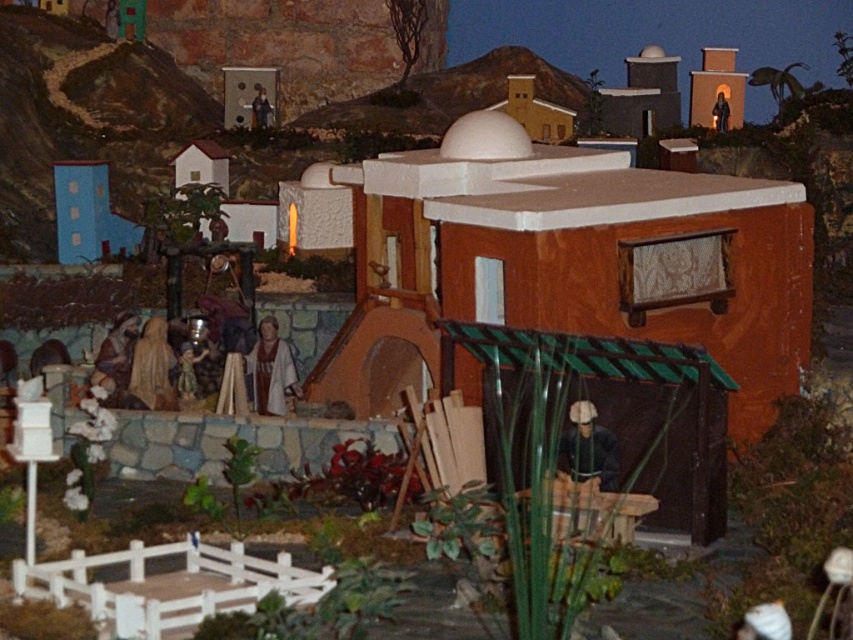
Question: Can you confirm if blue fabric hut at left is positioned to the left of matte black statue at upper right?

Choices:
 (A) yes
 (B) no

Answer: (A)

Question: Is blue fabric hut at left thinner than matte black statue at upper right?

Choices:
 (A) no
 (B) yes

Answer: (A)

Question: Can you confirm if matte orange hut at center is wider than smooth brown statue at lower left?

Choices:
 (A) yes
 (B) no

Answer: (A)

Question: Which point appears closest to the camera in this image?

Choices:
 (A) tap(585, 465)
 (B) tap(99, 173)
 (C) tap(564, 115)

Answer: (A)

Question: Which point is closer to the camera taking this photo?

Choices:
 (A) (126, 378)
 (B) (543, 125)
 (C) (724, 93)
 (D) (573, 412)

Answer: (D)

Question: Which of these objects is positioned farthest from the matte black statue at upper right?

Choices:
 (A) smooth brown statue at lower left
 (B) matte orange hut at center
 (C) smooth brown statue at upper center
 (D) matte orange hut at upper center

Answer: (A)